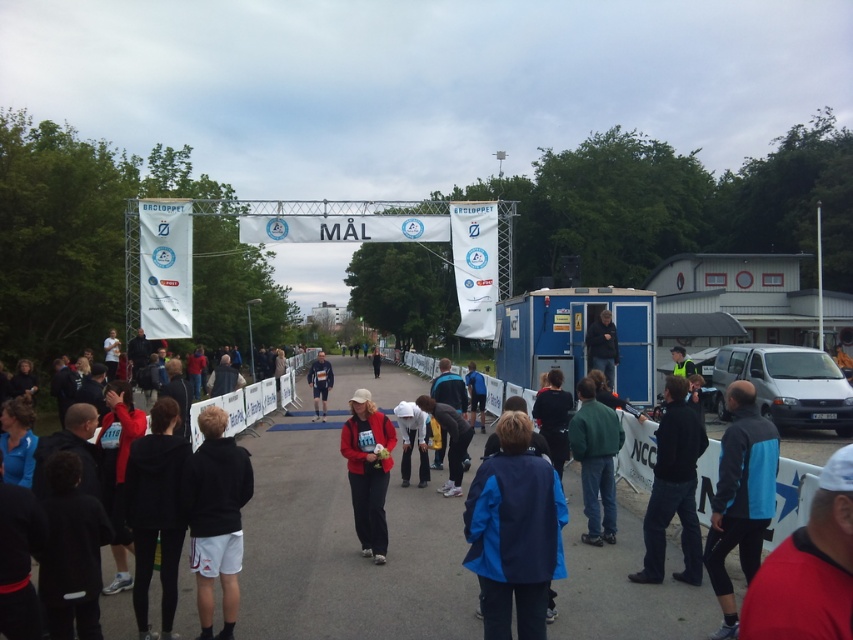
Measure the distance between red matte cap at upper right and black fabric jacket at left.

red matte cap at upper right and black fabric jacket at left are 28.64 feet apart from each other.

Is red matte cap at upper right to the right of black fabric jacket at left from the viewer's perspective?

Indeed, red matte cap at upper right is positioned on the right side of black fabric jacket at left.

Which is behind, point (788, 557) or point (201, 470)?

Point (201, 470)

This screenshot has height=640, width=853. In order to click on red matte cap at upper right in this screenshot , I will do `click(808, 568)`.

Based on the photo, is black fabric jacket at left positioned behind dark blue jacket at center?

No.

Where is `black fabric jacket at left`? This screenshot has height=640, width=853. black fabric jacket at left is located at coordinates (213, 472).

Who is more distant from viewer, [242,396] or [596,481]?

Positioned behind is point [242,396].

This screenshot has height=640, width=853. In order to click on black fabric jacket at left in this screenshot , I will do `click(213, 472)`.